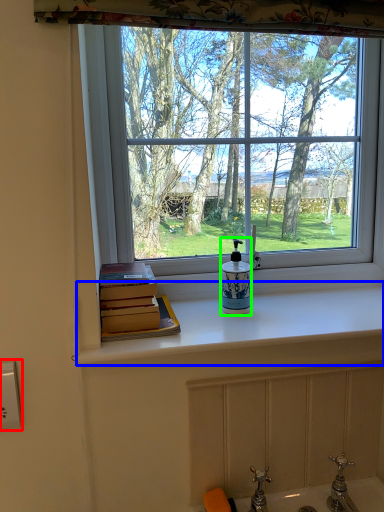
Question: Considering the real-world distances, which object is farthest from electric outlet (highlighted by a red box)? counter top (highlighted by a blue box) or soap dispenser (highlighted by a green box)?

Choices:
 (A) counter top
 (B) soap dispenser

Answer: (A)